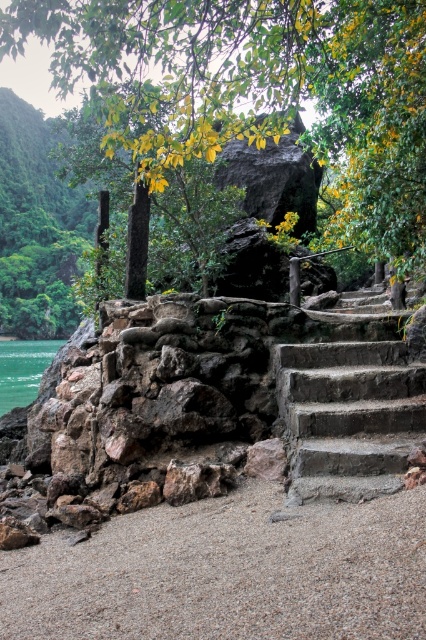
You are a hiker standing at the bottom of the dark gray concrete stairs at right and want to reach the green leafy tree at upper center. Which direction should you walk to get there?

The green leafy tree at upper center is positioned over the dark gray concrete stairs at right, so you should walk up the dark gray concrete stairs at right to reach the green leafy tree at upper center.

Consider the image. You are a small robot with a width of 20 inches. You are currently standing on the smooth sand at lower center and want to reach the dark gray concrete stairs at right. Can you move directly to the stairs without needing to adjust your path?

The smooth sand at lower center and dark gray concrete stairs at right are 23.02 inches apart from each other. Since your width is 20 inches, there is enough space between them to move directly without adjusting your path.